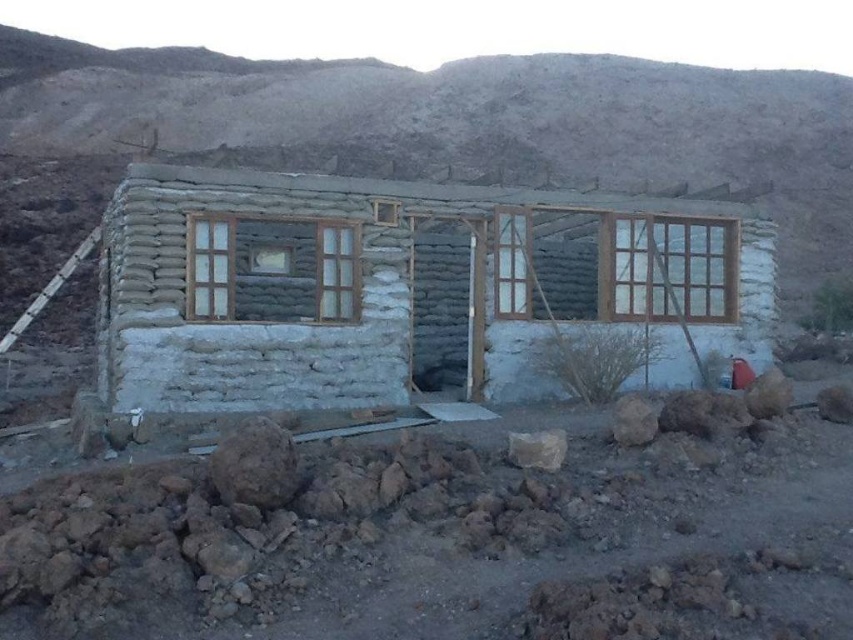
Who is positioned more to the left, gray stone house at center or wooden-framed glass window at center?

Positioned to the left is gray stone house at center.

Is point (337, 99) more distant than point (329, 237)?

Yes.

Find the location of a particular element. This screenshot has height=640, width=853. gray stone house at center is located at coordinates (x=463, y=124).

Does gray stone house at center appear over clear glass door at center?

Yes.

How distant is gray stone house at center from clear glass door at center?

gray stone house at center and clear glass door at center are 13.87 meters apart.

What do you see at coordinates (463, 124) in the screenshot?
I see `gray stone house at center` at bounding box center [463, 124].

This screenshot has width=853, height=640. In order to click on gray stone house at center in this screenshot , I will do `click(463, 124)`.

Is point (262, 385) positioned after point (512, 291)?

No, it is in front of (512, 291).

Between point (140, 168) and point (503, 316), which one is positioned behind?

Positioned behind is point (503, 316).

Does point (396, 276) lie in front of point (500, 285)?

Yes, point (396, 276) is closer to viewer.

Find the location of a particular element. white mud hut at center is located at coordinates (401, 289).